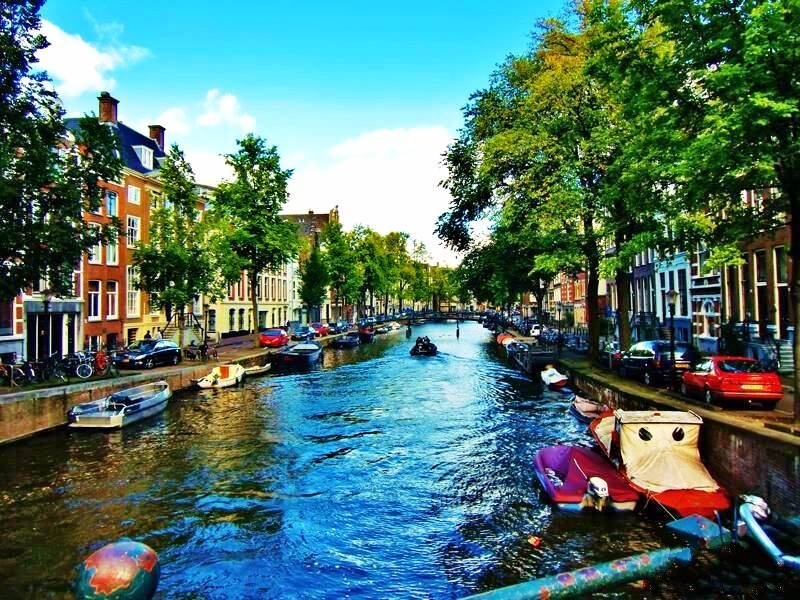
Where is `chimney`? The image size is (800, 600). chimney is located at coordinates (110, 109), (158, 136), (310, 212).